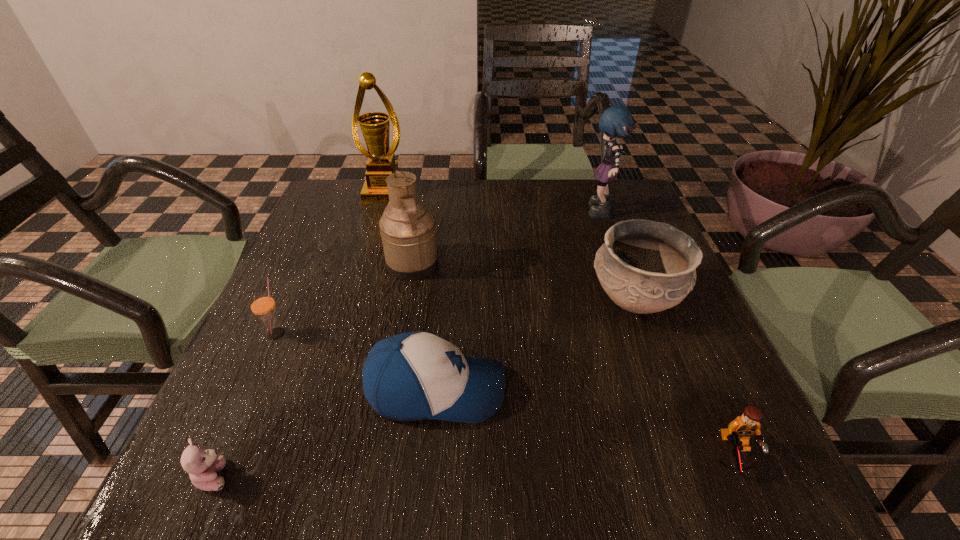
Locate an element on the screen. Image resolution: width=960 pixels, height=540 pixels. empty location between the award and the sixth farthest object is located at coordinates (411, 291).

Image resolution: width=960 pixels, height=540 pixels. Find the location of `vacant region between the straw and the Lego`. vacant region between the straw and the Lego is located at coordinates point(505,394).

Where is `blank region between the teddy bear and the award`? blank region between the teddy bear and the award is located at coordinates (300, 333).

Locate an element on the screen. unoccupied area between the third nearest object and the Lego is located at coordinates (585, 422).

The width and height of the screenshot is (960, 540). Identify the location of vacant area between the sixth shortest object and the Lego. (573, 359).

This screenshot has width=960, height=540. I want to click on vacant area that lies between the teddy bear and the straw, so click(x=246, y=404).

Where is `object that stands as the second closest to the pottery`? This screenshot has height=540, width=960. object that stands as the second closest to the pottery is located at coordinates (411, 376).

At what (x,y) coordinates should I click in order to perform the action: click on object that is the third closest one to the pottery. Please return your answer as a coordinate pair (x, y). Looking at the image, I should click on (739, 431).

Locate an element on the screen. free spot that satisfies the following two spatial constraints: 1. on the front-facing side of the award; 2. on the left side of the sixth shortest object is located at coordinates (364, 264).

Locate an element on the screen. This screenshot has width=960, height=540. free region that satisfies the following two spatial constraints: 1. on the front-facing side of the rag doll; 2. on the front side of the sixth shortest object is located at coordinates (620, 264).